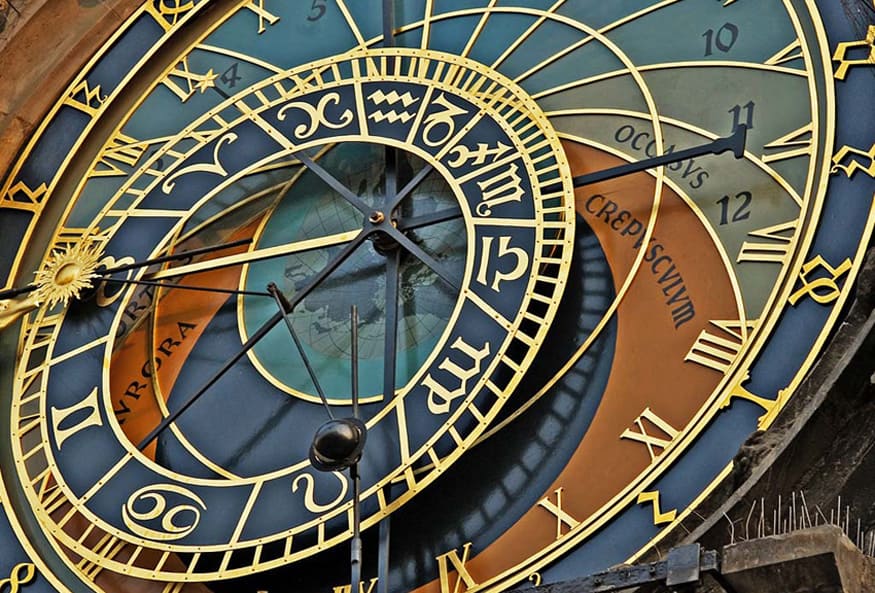
Where is `clock face`? clock face is located at coordinates (620, 358).